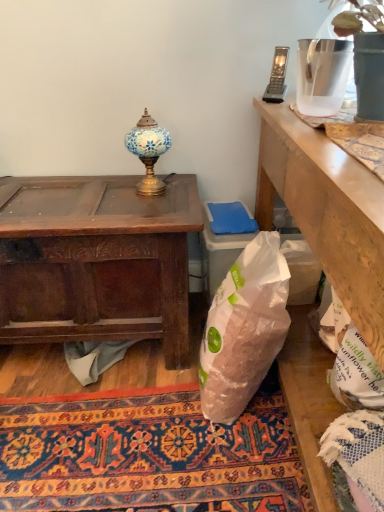
At what (x,y) coordinates should I click in order to perform the action: click on vacant area that lies between gray fabric at lower center and translucent plastic bag at center. Please return your answer as a coordinate pair (x, y). Looking at the image, I should click on (156, 384).